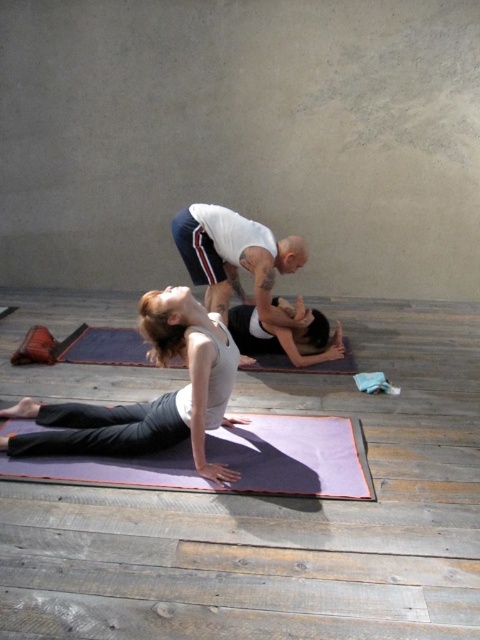
You are a photographer setting up for a yoga session. You need to position a light source to illuminate the matte white tank top at center without casting shadows on the neutral beige walls. Based on the coordinates provided, where should you place the light source relative to the tank top?

The matte white tank top at center is located at point (147, 401). To avoid casting shadows on the walls, the light source should be placed directly above or behind the tank top so that the light falls evenly without creating shadows on the walls.

You are a photographer setting up for a yoga class photo. You need to ensure the matte white tank top at center and the purple rubber yoga mat at lower center are both visible in the frame. Given their sizes, which object should you prioritize framing closer to avoid cropping?

The matte white tank top at center is bigger than the purple rubber yoga mat at lower center, so you should prioritize framing the matte white tank top at center closer to avoid cropping since it requires more space in the frame.